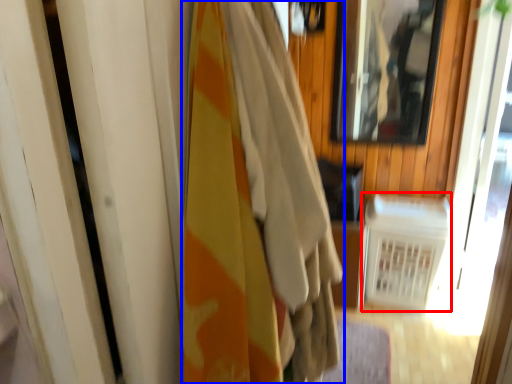
Question: Among these objects, which one is nearest to the camera, radiator (highlighted by a red box) or curtain (highlighted by a blue box)?

Choices:
 (A) radiator
 (B) curtain

Answer: (B)